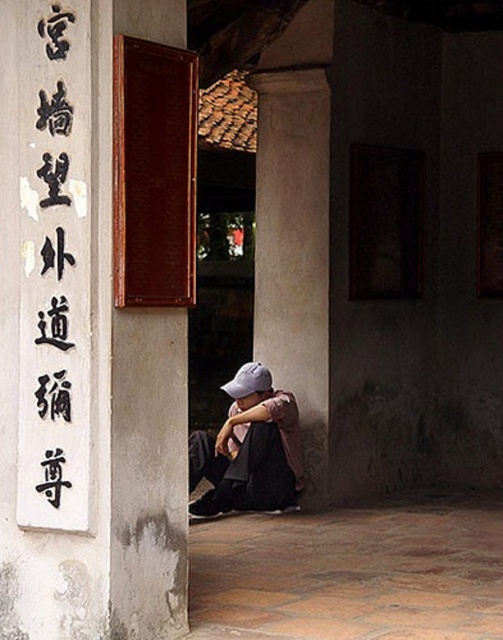
You are an interior designer assessing the layout of this traditional building. You need to determine if the black calligraphy at upper left can fit into a display case designed for the denim jacket at lower center. Based on their widths, will it fit?

The black calligraphy at upper left has a smaller width than the denim jacket at lower center, so it will fit into the display case designed for the denim jacket at lower center.

You are standing in front of the ancient building and notice the smooth concrete pillar at lower center and the black calligraphy at upper left. Which object is positioned higher up in the image?

The smooth concrete pillar at lower center is located above the black calligraphy at upper left, so the smooth concrete pillar at lower center is positioned higher up in the image.

You are an interior designer assessing the space for a new display. You notice the white stone sign at upper left and the denim jacket at lower center. Which object would require a larger display area due to its size?

The white stone sign at upper left is bigger than the denim jacket at lower center, so it would require a larger display area.